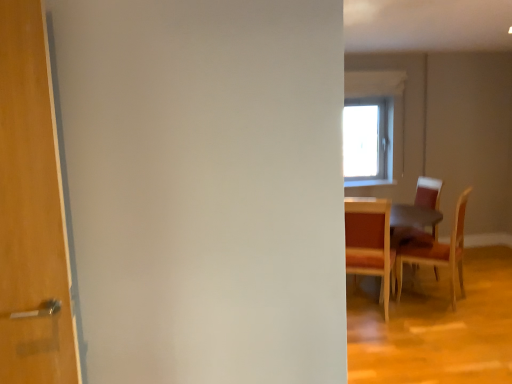
What is the approximate height of wooden table at right?

wooden table at right is 30.55 inches tall.

Where is `wooden chair at right, the 1th chair positioned from the right`? wooden chair at right, the 1th chair positioned from the right is located at coordinates (437, 252).

This screenshot has height=384, width=512. Identify the location of wooden chair at right, the second chair viewed from the left. (428, 193).

From the picture: Considering the sizes of objects wooden chair at right, the 1th chair positioned from the right, and wooden chair at right, which is counted as the 3th chair, starting from the right, in the image provided, who is taller, wooden chair at right, the 1th chair positioned from the right, or wooden chair at right, which is counted as the 3th chair, starting from the right,?

wooden chair at right, the 1th chair positioned from the right, is taller.

From the image's perspective, is wooden chair at right, the 1th chair positioned from the right, below wooden chair at right, which is counted as the 3th chair, starting from the right?

No.

Would you say wooden chair at right, the 1th chair positioned from the right, is outside wooden chair at right, which is counted as the 3th chair, starting from the right?

Yes, wooden chair at right, the 1th chair positioned from the right, is outside of wooden chair at right, which is counted as the 3th chair, starting from the right.

Considering the sizes of objects wooden chair at right, the 1th chair positioned from the right, and wooden chair at right, which is counted as the 3th chair, starting from the right, in the image provided, who is smaller, wooden chair at right, the 1th chair positioned from the right, or wooden chair at right, which is counted as the 3th chair, starting from the right,?

Smaller between the two is wooden chair at right, which is counted as the 3th chair, starting from the right.

Based on their positions, is wooden chair at right, the second chair viewed from the left, located to the left or right of wooden table at right?

wooden chair at right, the second chair viewed from the left, is to the right of wooden table at right.

In the scene shown: Is wooden chair at right, the second chair viewed from the left, thinner than wooden table at right?

Yes.

Is wooden chair at right, the second chair viewed from the left, positioned with its back to wooden table at right?

Yes, wooden chair at right, the second chair viewed from the left, is positioned with its back facing wooden table at right.

Which object is more forward, wooden chair at right, the 1th chair positioned from the right, or wooden table at right?

wooden chair at right, the 1th chair positioned from the right, is closer to the camera.

Which of these two, wooden chair at right, the 1th chair positioned from the right, or wooden table at right, stands shorter?

With less height is wooden table at right.

You are a GUI agent. You are given a task and a screenshot of the screen. Output one action in this format:
    pyautogui.click(x=<x>, y=<y>)
    Task: Click on the 2nd chair above the wooden table at right (from the image's perspective)
    The width and height of the screenshot is (512, 384).
    Given the screenshot: What is the action you would take?
    pyautogui.click(x=437, y=252)

From a real-world perspective, is wooden table at right beneath wooden chair at right, which is the 3th chair from left to right?

Correct, in the physical world, wooden table at right is lower than wooden chair at right, which is the 3th chair from left to right.

Could you tell me if wooden table at right is turned towards wooden chair at right, the 1th chair positioned from the right?

Yes, wooden table at right is turned towards wooden chair at right, the 1th chair positioned from the right.

What's the angular difference between wooden table at right and wooden chair at right, the 1th chair positioned from the right,'s facing directions?

wooden table at right and wooden chair at right, the 1th chair positioned from the right, are facing 133 degrees away from each other.

Which is farther from the camera, (x=382, y=289) or (x=431, y=246)?

The point (x=431, y=246) is behind.

Considering the relative sizes of wooden table at right and wooden chair at right, the second chair viewed from the left, in the image provided, is wooden table at right wider than wooden chair at right, the second chair viewed from the left,?

Indeed, wooden table at right has a greater width compared to wooden chair at right, the second chair viewed from the left.

From a real-world perspective, is wooden table at right located beneath wooden chair at right, acting as the 2th chair starting from the right?

Yes, from a real-world perspective, wooden table at right is below wooden chair at right, acting as the 2th chair starting from the right.

Considering the relative positions of wooden table at right and wooden chair at right, the second chair viewed from the left, in the image provided, is wooden table at right behind wooden chair at right, the second chair viewed from the left,?

No, the depth of wooden table at right is less than that of wooden chair at right, the second chair viewed from the left.

Who is bigger, wooden table at right or wooden chair at right, acting as the 2th chair starting from the right?

wooden table at right is bigger.

Is wooden chair at right, which is the 3th chair from left to right, facing away from wooden chair at right, acting as the 2th chair starting from the right?

wooden chair at right, which is the 3th chair from left to right, is not turned away from wooden chair at right, acting as the 2th chair starting from the right.

Can we say wooden chair at right, which is the 3th chair from left to right, lies outside wooden chair at right, acting as the 2th chair starting from the right?

wooden chair at right, which is the 3th chair from left to right, lies outside wooden chair at right, acting as the 2th chair starting from the right,'s area.

Does wooden chair at right, which is the 3th chair from left to right, come behind wooden chair at right, acting as the 2th chair starting from the right?

No, it is in front of wooden chair at right, acting as the 2th chair starting from the right.

Can you confirm if wooden chair at right, which is the 3th chair from left to right, is wider than wooden chair at right, acting as the 2th chair starting from the right?

Correct, the width of wooden chair at right, which is the 3th chair from left to right, exceeds that of wooden chair at right, acting as the 2th chair starting from the right.

From the image's perspective, between wooden chair at right, the 1th chair in the left-to-right sequence, and wooden table at right, who is located below?

wooden table at right is shown below in the image.

Does wooden chair at right, the 1th chair in the left-to-right sequence, have a smaller size compared to wooden table at right?

Indeed, wooden chair at right, the 1th chair in the left-to-right sequence, has a smaller size compared to wooden table at right.

Would you say wooden chair at right, which is counted as the 3th chair, starting from the right, is outside wooden table at right?

That's incorrect, wooden chair at right, which is counted as the 3th chair, starting from the right, is not completely outside wooden table at right.

From a real-world perspective, which is physically above, wooden chair at right, which is counted as the 3th chair, starting from the right, or wooden table at right?

wooden chair at right, which is counted as the 3th chair, starting from the right, from a real-world perspective.

Locate an element on the screen. This screenshot has height=384, width=512. chair below the wooden chair at right, the 1th chair positioned from the right (from a real-world perspective) is located at coordinates (369, 242).

Identify the location of table that appears in front of the wooden chair at right, the second chair viewed from the left. (374, 238).

Estimate the real-world distances between objects in this image. Which object is closer to wooden chair at right, the 1th chair in the left-to-right sequence, wooden table at right or wooden chair at right, acting as the 2th chair starting from the right?

wooden table at right.

From the image, which object appears to be farther from wooden chair at right, which is the 3th chair from left to right, wooden chair at right, the second chair viewed from the left, or wooden table at right?

Based on the image, wooden table at right appears to be further to wooden chair at right, which is the 3th chair from left to right.

Which object lies further to the anchor point wooden table at right, wooden chair at right, acting as the 2th chair starting from the right, or wooden chair at right, the 1th chair in the left-to-right sequence?

The object further to wooden table at right is wooden chair at right, acting as the 2th chair starting from the right.

Which object lies nearer to the anchor point wooden chair at right, the 1th chair in the left-to-right sequence, wooden chair at right, acting as the 2th chair starting from the right, or wooden chair at right, the 1th chair positioned from the right?

wooden chair at right, the 1th chair positioned from the right.

From the image, which object appears to be farther from wooden table at right, wooden chair at right, which is counted as the 3th chair, starting from the right, or wooden chair at right, which is the 3th chair from left to right?

wooden chair at right, which is the 3th chair from left to right, lies further to wooden table at right than the other object.

Based on the photo, based on their spatial positions, is wooden table at right or wooden chair at right, the 1th chair in the left-to-right sequence, closer to wooden chair at right, which is the 3th chair from left to right?

wooden table at right lies closer to wooden chair at right, which is the 3th chair from left to right, than the other object.

Estimate the real-world distances between objects in this image. Which object is further from wooden table at right, wooden chair at right, the second chair viewed from the left, or wooden chair at right, the 1th chair positioned from the right?

The object further to wooden table at right is wooden chair at right, the second chair viewed from the left.

Looking at the image, which one is located closer to wooden chair at right, the 1th chair positioned from the right, wooden chair at right, acting as the 2th chair starting from the right, or wooden chair at right, the 1th chair in the left-to-right sequence?

wooden chair at right, acting as the 2th chair starting from the right, lies closer to wooden chair at right, the 1th chair positioned from the right, than the other object.

Find the location of `table between wooden chair at right, which is the 3th chair from left to right, and wooden chair at right, the second chair viewed from the left, along the z-axis`. table between wooden chair at right, which is the 3th chair from left to right, and wooden chair at right, the second chair viewed from the left, along the z-axis is located at coordinates (374, 238).

You are a GUI agent. You are given a task and a screenshot of the screen. Output one action in this format:
    pyautogui.click(x=<x>, y=<y>)
    Task: Click on the chair between wooden chair at right, the 1th chair in the left-to-right sequence, and wooden chair at right, the second chair viewed from the left, from front to back
    
    Given the screenshot: What is the action you would take?
    pyautogui.click(x=437, y=252)

Identify the location of table between wooden chair at right, which is counted as the 3th chair, starting from the right, and wooden chair at right, which is the 3th chair from left to right, from left to right. This screenshot has width=512, height=384. (374, 238).

Where is `table located between wooden chair at right, which is counted as the 3th chair, starting from the right, and wooden chair at right, the second chair viewed from the left, in the depth direction`? The height and width of the screenshot is (384, 512). table located between wooden chair at right, which is counted as the 3th chair, starting from the right, and wooden chair at right, the second chair viewed from the left, in the depth direction is located at coordinates (374, 238).